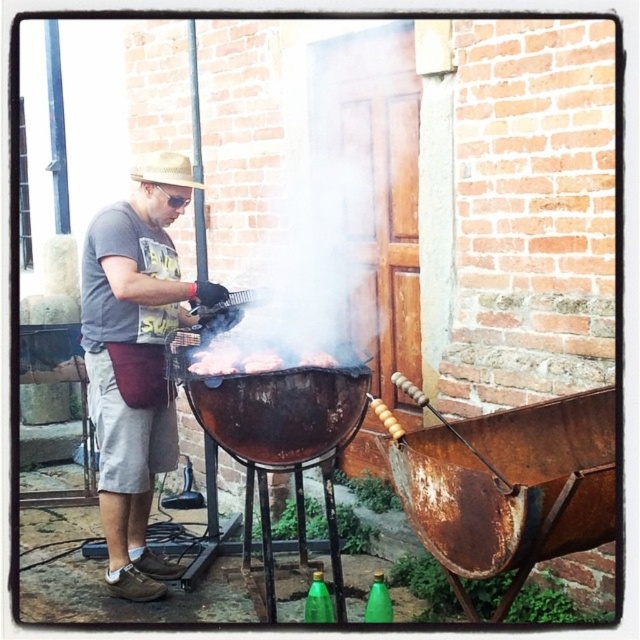
Consider the image. You are standing in front of the barbecue grill and see two points marked on it. The first point is at coordinates point [154,154] and the second point is at point [282,360]. Which point is closer to you?

Point [154,154] is further to the camera than point [282,360], so the point closer to you is point [282,360].

You are standing in front of the barbecue grill and want to place a new piece of meat on the grill. The grill has two spots available at coordinates point (198, 349) and point (154, 164). Which spot is closer to you?

Point (198, 349) is closer to the viewer than point (154, 164), so you should place the meat there.

The man is wearing a red apron and has a straw hat at upper left. He is standing next to the charcoal briquettes at center. Which object is positioned higher relative to the other?

The straw hat at upper left is above the charcoal briquettes at center.